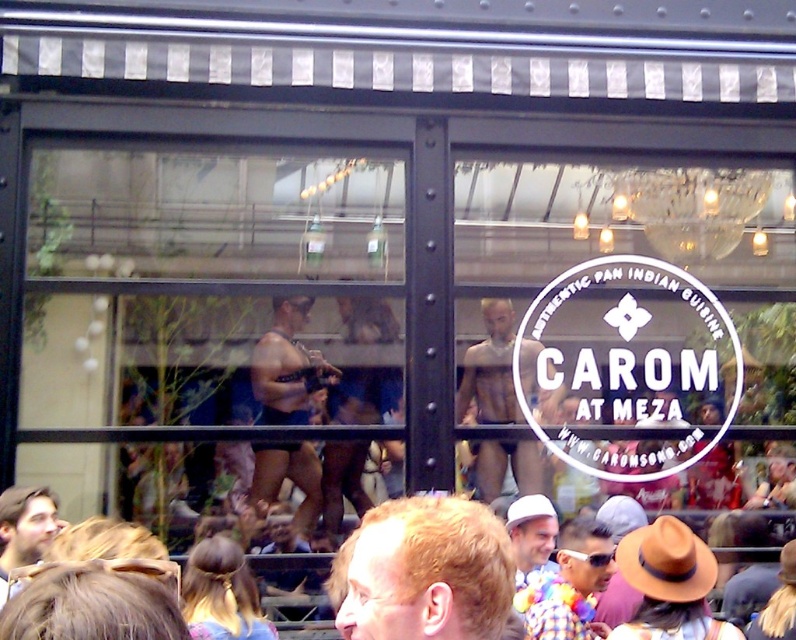
You are standing outside the restaurant and want to enter through the transparent glass door at upper left. There is a brown felt hat at lower right on the ground. Can you step over the hat to reach the door?

The transparent glass door at upper left is further to the viewer than brown felt hat at lower right, so the hat is closer to you. You can step over the brown felt hat at lower right to reach the door since it is in your path.